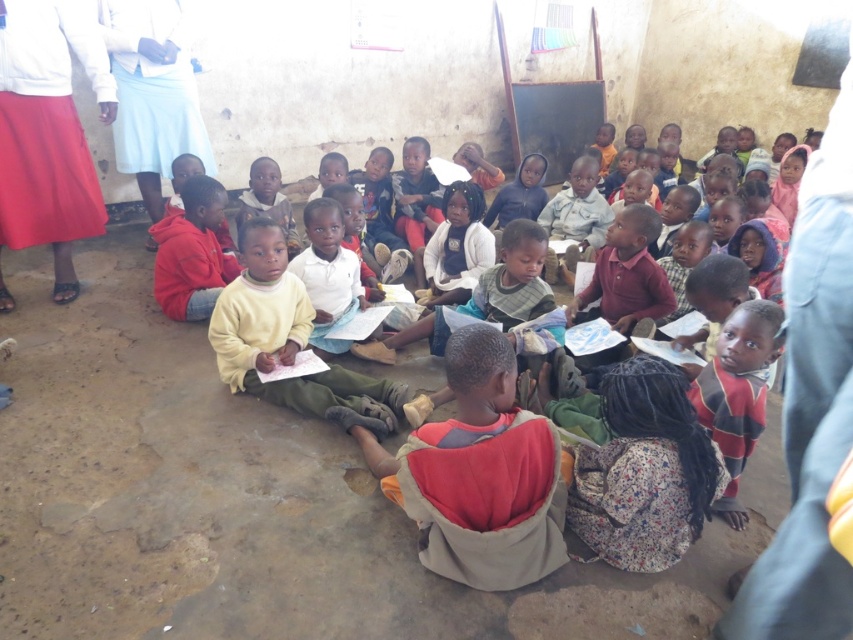
Who is taller, blue denim jacket at upper right or yellow cotton shirt at center?

A: blue denim jacket at upper right

Based on the photo, does blue denim jacket at upper right appear on the left side of yellow cotton shirt at center?

Indeed, blue denim jacket at upper right is positioned on the left side of yellow cotton shirt at center.

This screenshot has height=640, width=853. What do you see at coordinates (811, 406) in the screenshot?
I see `blue denim jacket at upper right` at bounding box center [811, 406].

The width and height of the screenshot is (853, 640). What are the coordinates of `blue denim jacket at upper right` in the screenshot? It's located at (811, 406).

Can you confirm if white fabric skirt at upper left is smaller than yellow cotton shirt at center?

Correct, white fabric skirt at upper left occupies less space than yellow cotton shirt at center.

Is white fabric skirt at upper left further to camera compared to yellow cotton shirt at center?

Yes, white fabric skirt at upper left is behind yellow cotton shirt at center.

What are the coordinates of `white fabric skirt at upper left` in the screenshot? It's located at (48, 131).

Which is below, white fabric skirt at upper left or white fabric at upper left?

white fabric skirt at upper left is lower down.

Can you confirm if white fabric skirt at upper left is shorter than white fabric at upper left?

Incorrect, white fabric skirt at upper left's height does not fall short of white fabric at upper left's.

This screenshot has width=853, height=640. I want to click on white fabric skirt at upper left, so click(48, 131).

You are a GUI agent. You are given a task and a screenshot of the screen. Output one action in this format:
    pyautogui.click(x=<x>, y=<y>)
    Task: Click on the white fabric skirt at upper left
    The width and height of the screenshot is (853, 640).
    Given the screenshot: What is the action you would take?
    pyautogui.click(x=48, y=131)